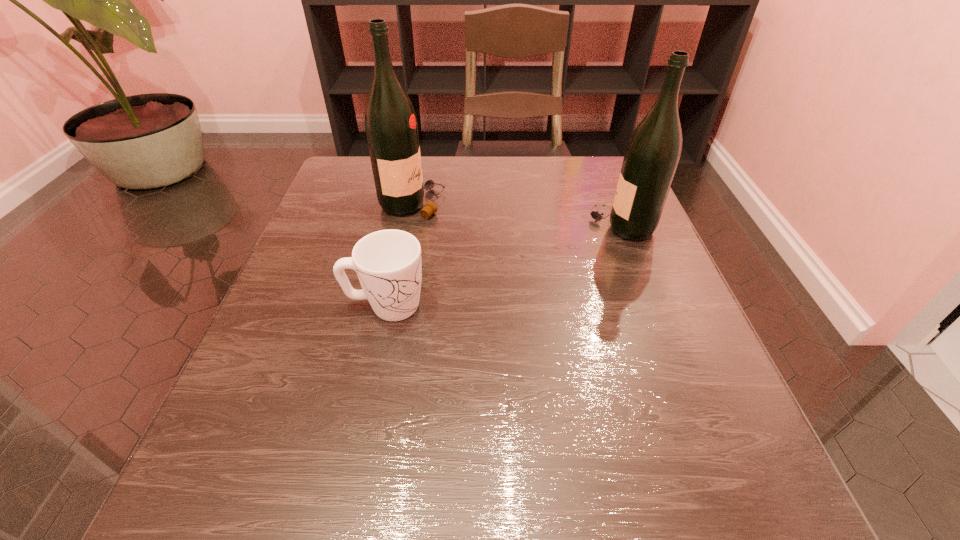
Locate an element on the screen. object that is at the far left corner is located at coordinates (391, 127).

Where is `object that is at the far right corner`? This screenshot has width=960, height=540. object that is at the far right corner is located at coordinates (653, 152).

In order to click on vacant area at the far edge in this screenshot , I will do `click(484, 207)`.

You are a GUI agent. You are given a task and a screenshot of the screen. Output one action in this format:
    pyautogui.click(x=<x>, y=<y>)
    Task: Click on the vacant region at the near edge
    The width and height of the screenshot is (960, 540).
    Given the screenshot: What is the action you would take?
    pyautogui.click(x=347, y=496)

Image resolution: width=960 pixels, height=540 pixels. Identify the location of vacant region at the left edge of the desktop. (336, 286).

Find the location of a particular element. This screenshot has height=540, width=960. vacant area at the right edge is located at coordinates (652, 360).

Locate an element on the screen. This screenshot has height=540, width=960. vacant space at the far left corner is located at coordinates (351, 188).

The height and width of the screenshot is (540, 960). I want to click on blank space at the near left corner of the desktop, so click(288, 474).

You are a GUI agent. You are given a task and a screenshot of the screen. Output one action in this format:
    pyautogui.click(x=<x>, y=<y>)
    Task: Click on the vacant area at the far right corner of the desktop
    
    Given the screenshot: What is the action you would take?
    pyautogui.click(x=579, y=171)

You are a GUI agent. You are given a task and a screenshot of the screen. Output one action in this format:
    pyautogui.click(x=<x>, y=<y>)
    Task: Click on the vacant space at the near right corner of the desktop
    
    Given the screenshot: What is the action you would take?
    pyautogui.click(x=652, y=517)